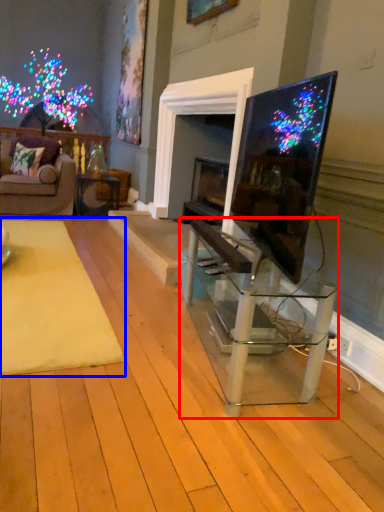
Question: Which of the following is the closest to the observer, table (highlighted by a red box) or mat (highlighted by a blue box)?

Choices:
 (A) table
 (B) mat

Answer: (A)